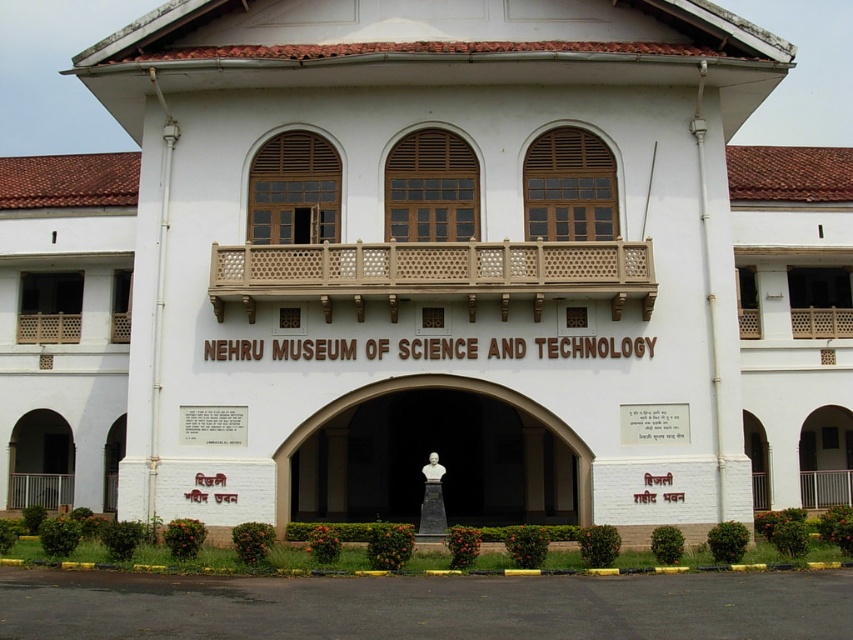
You are planning to place a new display case in the museum entrance. The display case is 1.2 meters wide. You see the white marble bust at center and the black marble bust at center. Which bust should you avoid placing the display case next to if you want to ensure there is enough space?

The white marble bust at center might be wider than the black marble bust at center, so to ensure enough space, avoid placing the display case next to the white marble bust at center.

You are standing at the entrance of the Nehru Museum of Science and Technology and see two points marked in the image. The first point is at coordinates point [310,419] and the second is at point [431,500]. Which point is closer to you?

Point [431,500] is closer to you because it is in front of point [310,419] according to the spatial arrangement described.

You are a visitor standing at the entrance of the Nehru Museum of Science and Technology. You notice two busts inside the large archway. The white marble bust at center and the black marble bust at center. If you want to take a photo of both busts in one frame, will you need to zoom out your camera? Please explain your answer based on their distance apart.

The white marble bust at center and the black marble bust at center are 12.35 feet apart. Since they are relatively far apart, you would need to zoom out your camera to capture both in one frame.